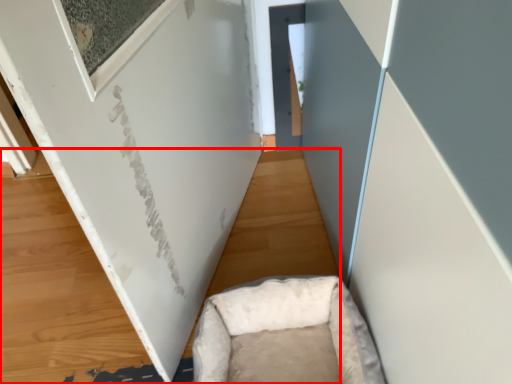
Question: Where is plywood (annotated by the red box) located in relation to furniture in the image?

Choices:
 (A) left
 (B) right

Answer: (A)